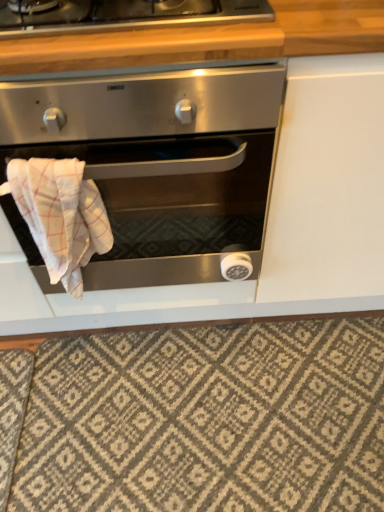
Question: Considering the relative positions of wooden at upper center and patterned carpet at lower center in the image provided, is wooden at upper center to the left of patterned carpet at lower center from the viewer's perspective?

Choices:
 (A) yes
 (B) no

Answer: (A)

Question: Does wooden at upper center have a lesser height compared to patterned carpet at lower center?

Choices:
 (A) yes
 (B) no

Answer: (B)

Question: Considering the relative sizes of wooden at upper center and patterned carpet at lower center in the image provided, is wooden at upper center bigger than patterned carpet at lower center?

Choices:
 (A) no
 (B) yes

Answer: (B)

Question: Would you say patterned carpet at lower center is part of wooden at upper center's contents?

Choices:
 (A) no
 (B) yes

Answer: (A)

Question: Is wooden at upper center oriented away from patterned carpet at lower center?

Choices:
 (A) yes
 (B) no

Answer: (B)

Question: Based on their positions, is white checkered cloth at lower left located to the left or right of patterned carpet at lower center?

Choices:
 (A) left
 (B) right

Answer: (A)

Question: In terms of height, does white checkered cloth at lower left look taller or shorter compared to patterned carpet at lower center?

Choices:
 (A) tall
 (B) short

Answer: (A)

Question: Would you say white checkered cloth at lower left is inside or outside patterned carpet at lower center?

Choices:
 (A) inside
 (B) outside

Answer: (B)

Question: From a real-world perspective, is white checkered cloth at lower left physically located above or below patterned carpet at lower center?

Choices:
 (A) below
 (B) above

Answer: (B)

Question: Do you think satin silver oven at center is within wooden at upper center, or outside of it?

Choices:
 (A) outside
 (B) inside

Answer: (A)

Question: From a real-world perspective, is satin silver oven at center above or below wooden at upper center?

Choices:
 (A) below
 (B) above

Answer: (A)

Question: In the image, is satin silver oven at center positioned in front of or behind wooden at upper center?

Choices:
 (A) behind
 (B) front

Answer: (B)

Question: Looking at their shapes, would you say satin silver oven at center is wider or thinner than wooden at upper center?

Choices:
 (A) thin
 (B) wide

Answer: (B)

Question: From the image's perspective, is satin silver oven at center located above or below patterned carpet at lower center?

Choices:
 (A) above
 (B) below

Answer: (A)

Question: Is satin silver oven at center in front of or behind patterned carpet at lower center in the image?

Choices:
 (A) front
 (B) behind

Answer: (A)